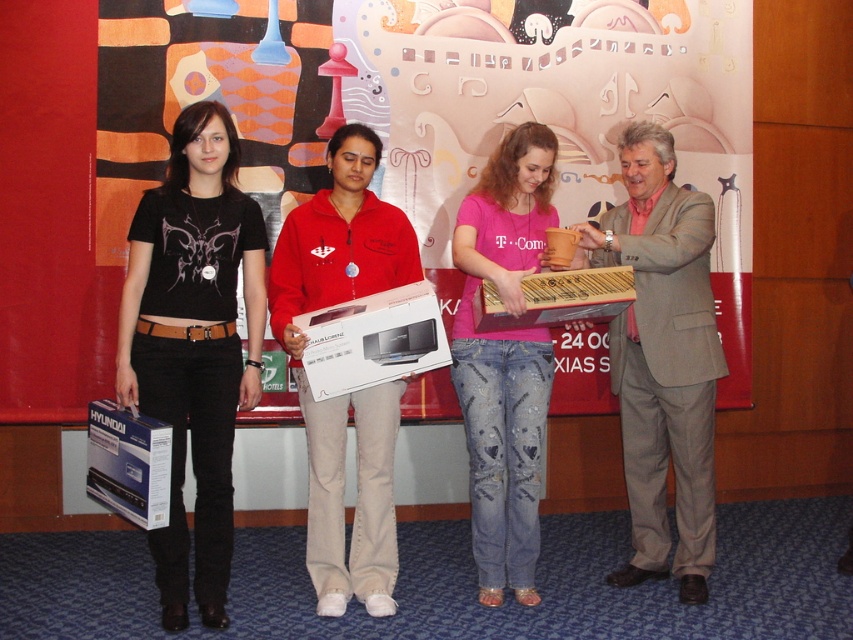
Can you confirm if light brown suit at right is wider than pink cotton shirt at center?

Correct, the width of light brown suit at right exceeds that of pink cotton shirt at center.

Between light brown suit at right and pink cotton shirt at center, which one appears on the left side from the viewer's perspective?

pink cotton shirt at center is more to the left.

Is point (612, 234) positioned before point (485, 442)?

Yes, it is in front of point (485, 442).

I want to click on light brown suit at right, so pos(662,358).

Is black matte t-shirt at center shorter than matte red hoodie at center?

In fact, black matte t-shirt at center may be taller than matte red hoodie at center.

Between black matte t-shirt at center and matte red hoodie at center, which one appears on the left side from the viewer's perspective?

From the viewer's perspective, black matte t-shirt at center appears more on the left side.

Between point (204, 237) and point (305, 420), which one is positioned behind?

Positioned behind is point (305, 420).

Find the location of a particular element. black matte t-shirt at center is located at coordinates (194, 344).

Which is more to the right, black matte t-shirt at center or light brown suit at right?

Positioned to the right is light brown suit at right.

Can you confirm if black matte t-shirt at center is taller than light brown suit at right?

Yes.

You are a GUI agent. You are given a task and a screenshot of the screen. Output one action in this format:
    pyautogui.click(x=<x>, y=<y>)
    Task: Click on the black matte t-shirt at center
    
    Given the screenshot: What is the action you would take?
    pyautogui.click(x=194, y=344)

Where is `black matte t-shirt at center`? This screenshot has width=853, height=640. black matte t-shirt at center is located at coordinates (194, 344).